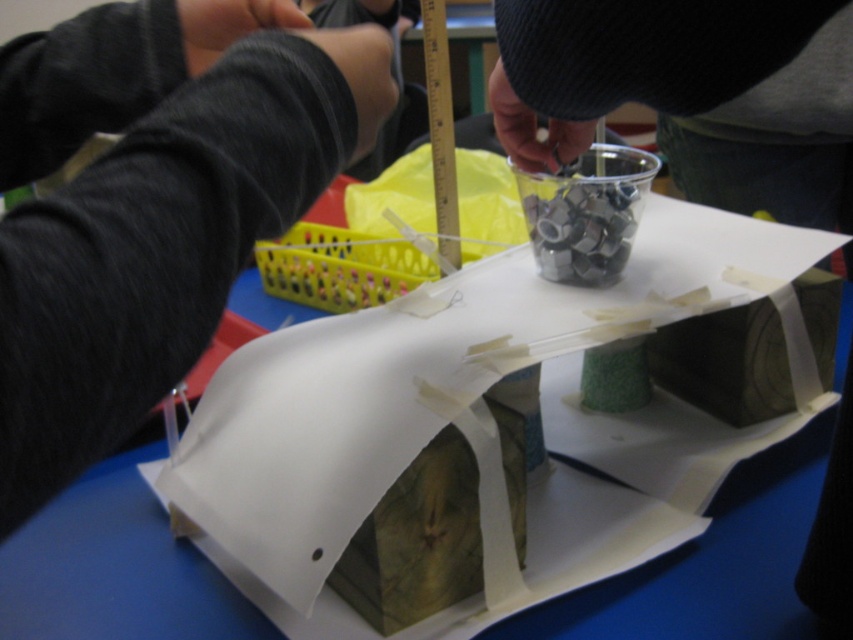
Does black fabric arm at upper left appear on the left side of green textured cup at upper center?

Correct, you'll find black fabric arm at upper left to the left of green textured cup at upper center.

Can you confirm if black fabric arm at upper left is wider than green textured cup at upper center?

In fact, black fabric arm at upper left might be narrower than green textured cup at upper center.

Is point (32, 332) positioned before point (814, 548)?

Yes.

What are the coordinates of `black fabric arm at upper left` in the screenshot? It's located at (151, 204).